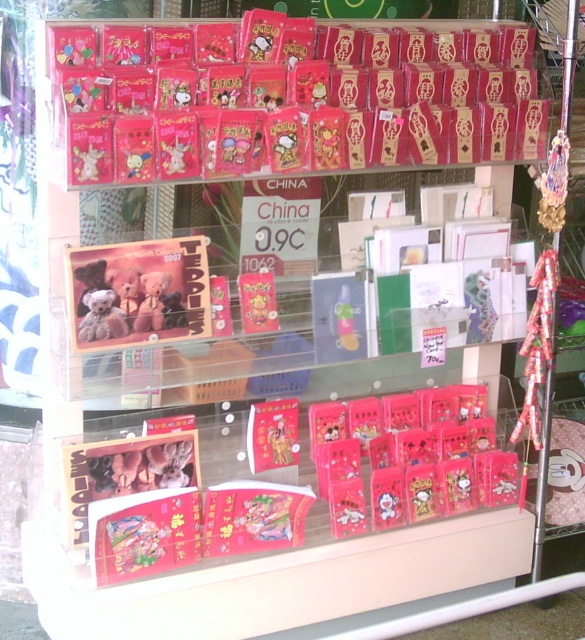
Question: Is matte red card at center below matte plastic toy at center?

Choices:
 (A) no
 (B) yes

Answer: (B)

Question: Observing the image, what is the correct spatial positioning of matte red card at center in reference to matte plastic toy at center?

Choices:
 (A) right
 (B) left

Answer: (B)

Question: Which of the following is the closest to the observer?

Choices:
 (A) matte plastic toy at center
 (B) matte red card at center

Answer: (A)

Question: Does matte red card at center appear on the right side of matte plastic toy at center?

Choices:
 (A) yes
 (B) no

Answer: (B)